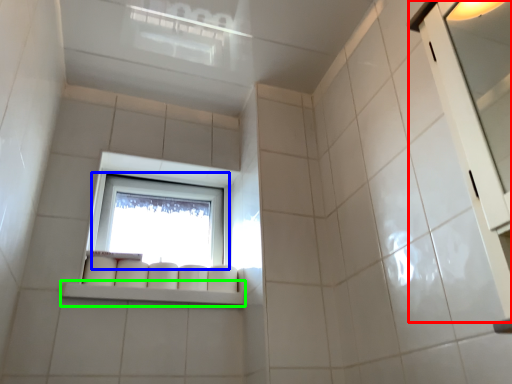
Question: Which is nearer to the screen door (highlighted by a red box)? window (highlighted by a blue box) or window sill (highlighted by a green box).

Choices:
 (A) window
 (B) window sill

Answer: (B)